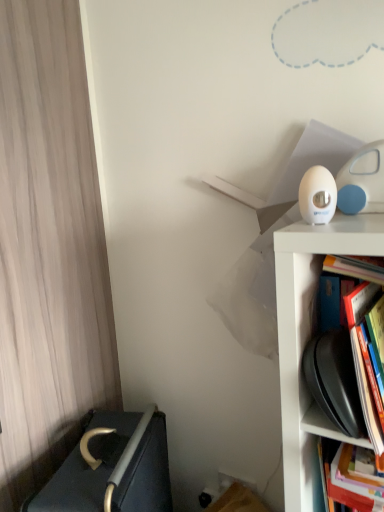
Question: Is dark gray fabric bed at lower left shorter than hardcover book at right, arranged as the first book when ordered from the bottom?

Choices:
 (A) yes
 (B) no

Answer: (B)

Question: Can you confirm if dark gray fabric bed at lower left is thinner than hardcover book at right, arranged as the first book when ordered from the bottom?

Choices:
 (A) yes
 (B) no

Answer: (B)

Question: Is dark gray fabric bed at lower left at the left side of hardcover book at right, positioned as the second book in top-to-bottom order?

Choices:
 (A) no
 (B) yes

Answer: (B)

Question: Does dark gray fabric bed at lower left have a greater width compared to hardcover book at right, positioned as the second book in top-to-bottom order?

Choices:
 (A) no
 (B) yes

Answer: (B)

Question: Could you tell me if dark gray fabric bed at lower left is facing hardcover book at right, arranged as the first book when ordered from the bottom?

Choices:
 (A) yes
 (B) no

Answer: (A)

Question: In terms of height, does dark gray fabric bed at lower left look taller or shorter compared to hardcover book at right, arranged as the first book when ordered from the bottom?

Choices:
 (A) tall
 (B) short

Answer: (A)

Question: Is dark gray fabric bed at lower left inside or outside of hardcover book at right, positioned as the second book in top-to-bottom order?

Choices:
 (A) outside
 (B) inside

Answer: (A)

Question: Is dark gray fabric bed at lower left wider or thinner than hardcover book at right, arranged as the first book when ordered from the bottom?

Choices:
 (A) wide
 (B) thin

Answer: (A)

Question: Considering their positions, is dark gray fabric bed at lower left located in front of or behind hardcover book at right, arranged as the first book when ordered from the bottom?

Choices:
 (A) behind
 (B) front

Answer: (A)

Question: Considering the positions of dark gray fabric bed at lower left and hardcover book at right, which is the 1th book from top to bottom, in the image, is dark gray fabric bed at lower left bigger or smaller than hardcover book at right, which is the 1th book from top to bottom,?

Choices:
 (A) big
 (B) small

Answer: (A)

Question: Would you say dark gray fabric bed at lower left is inside or outside hardcover book at right, which is the 2th book in bottom-to-top order?

Choices:
 (A) outside
 (B) inside

Answer: (A)

Question: From their relative heights in the image, would you say dark gray fabric bed at lower left is taller or shorter than hardcover book at right, which is the 1th book from top to bottom?

Choices:
 (A) short
 (B) tall

Answer: (B)

Question: In the image, is dark gray fabric bed at lower left positioned in front of or behind hardcover book at right, which is the 2th book in bottom-to-top order?

Choices:
 (A) behind
 (B) front

Answer: (A)

Question: From the image's perspective, is hardcover book at right, arranged as the first book when ordered from the bottom, positioned above or below wooden curtain at left?

Choices:
 (A) below
 (B) above

Answer: (A)

Question: Is hardcover book at right, arranged as the first book when ordered from the bottom, in front of or behind wooden curtain at left in the image?

Choices:
 (A) front
 (B) behind

Answer: (A)